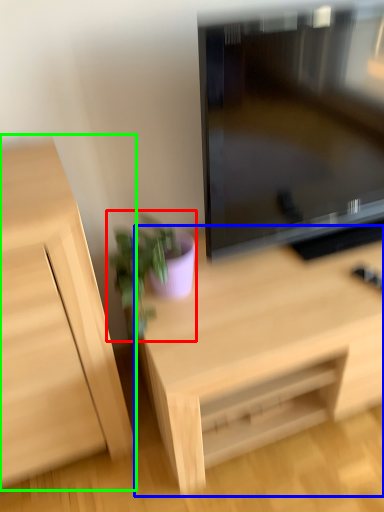
Question: Considering the real-world distances, which object is closest to houseplant (highlighted by a red box)? desk (highlighted by a blue box) or cabinetry (highlighted by a green box).

Choices:
 (A) desk
 (B) cabinetry

Answer: (B)